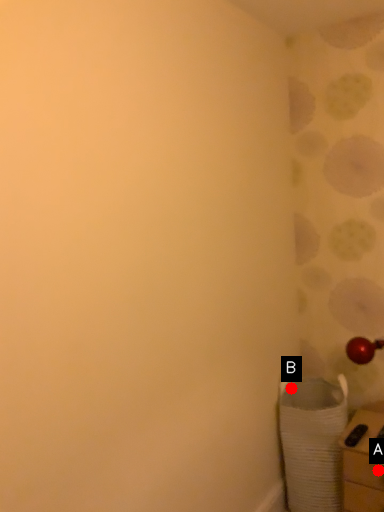
Question: Two points are circled on the image, labeled by A and B beside each circle. Which point appears closest to the camera in this image?

Choices:
 (A) A is closer
 (B) B is closer

Answer: (A)